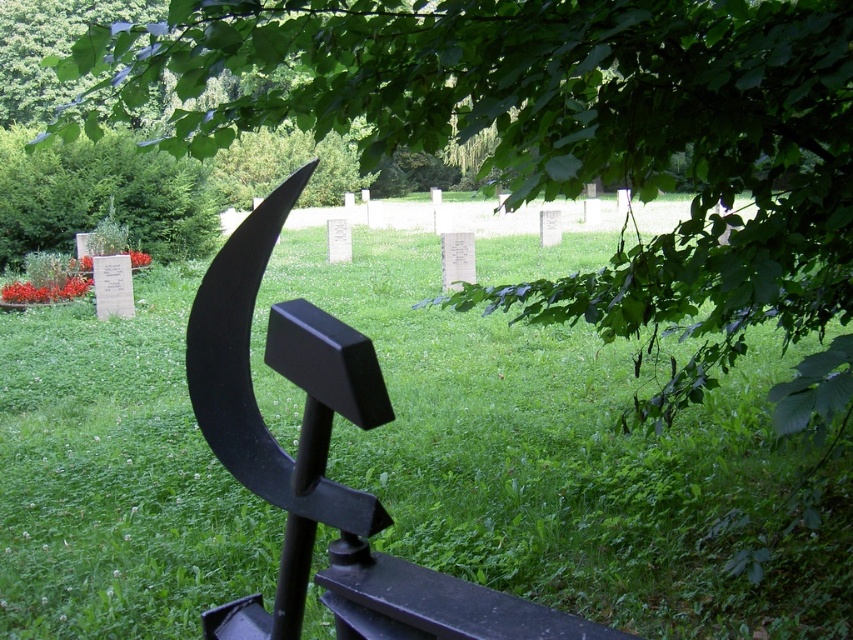
Consider the image. Is green grass at center wider than green leafy tree at upper left?

Yes, green grass at center is wider than green leafy tree at upper left.

Who is more distant from viewer, (486, 384) or (796, 380)?

The point (486, 384) is more distant.

Which is in front, point (392, 364) or point (827, 42)?

Positioned in front is point (827, 42).

At what (x,y) coordinates should I click in order to perform the action: click on green grass at center. Please return your answer as a coordinate pair (x, y). This screenshot has height=640, width=853. Looking at the image, I should click on (563, 458).